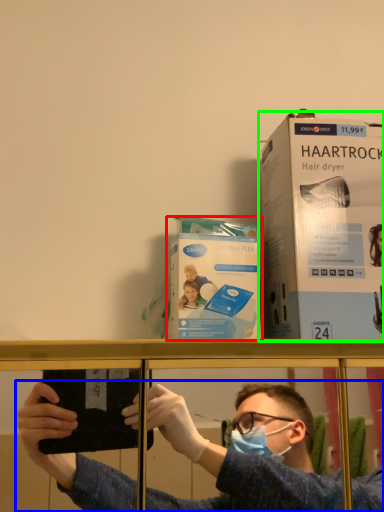
Question: Estimate the real-world distances between objects in this image. Which object is closer to paperback book (highlighted by a red box), person (highlighted by a blue box) or paperback book (highlighted by a green box)?

Choices:
 (A) person
 (B) paperback book

Answer: (B)